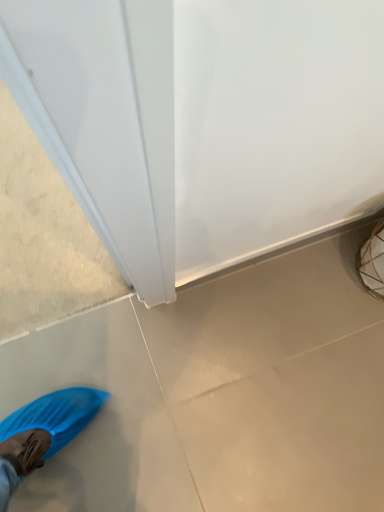
The image size is (384, 512). Describe the element at coordinates (278, 382) in the screenshot. I see `smooth concrete floor at lower left` at that location.

Image resolution: width=384 pixels, height=512 pixels. I want to click on smooth concrete floor at lower left, so coord(278,382).

At what (x,y) coordinates should I click in order to perform the action: click on smooth concrete floor at lower left. Please return your answer as a coordinate pair (x, y). This screenshot has height=512, width=384. Looking at the image, I should click on tap(278, 382).